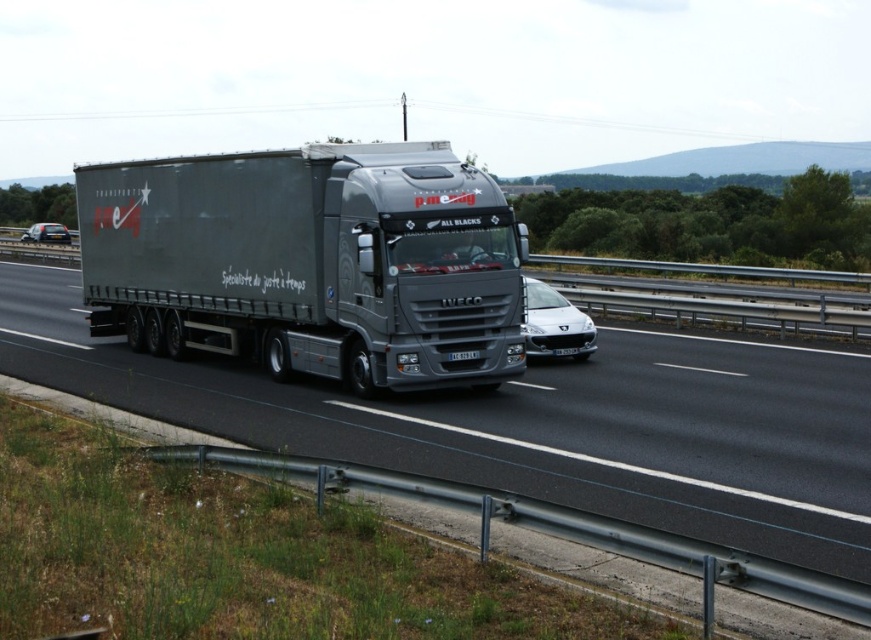
Question: Is metallic truck at center bigger than matte black trailer truck at left?

Choices:
 (A) yes
 (B) no

Answer: (A)

Question: Can you confirm if metallic truck at center is smaller than matte black trailer truck at left?

Choices:
 (A) no
 (B) yes

Answer: (A)

Question: Can you confirm if metallic truck at center is positioned to the right of matte black trailer truck at left?

Choices:
 (A) no
 (B) yes

Answer: (B)

Question: Which point is closer to the camera?

Choices:
 (A) metallic truck at center
 (B) matte black trailer truck at left

Answer: (A)

Question: Among these objects, which one is nearest to the camera?

Choices:
 (A) matte black trailer truck at left
 (B) metallic truck at center

Answer: (B)

Question: Which object appears farthest from the camera in this image?

Choices:
 (A) metallic truck at center
 (B) matte black trailer truck at left

Answer: (B)